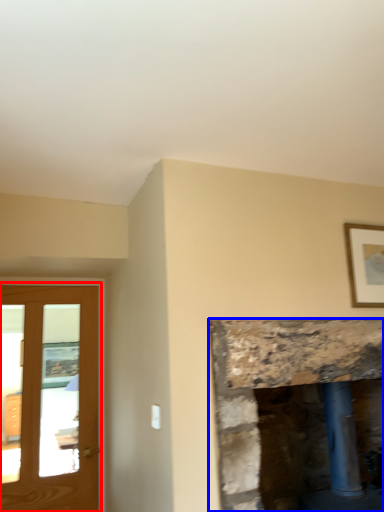
Question: Which object is further to the camera taking this photo, screen door (highlighted by a red box) or fireplace (highlighted by a blue box)?

Choices:
 (A) screen door
 (B) fireplace

Answer: (A)